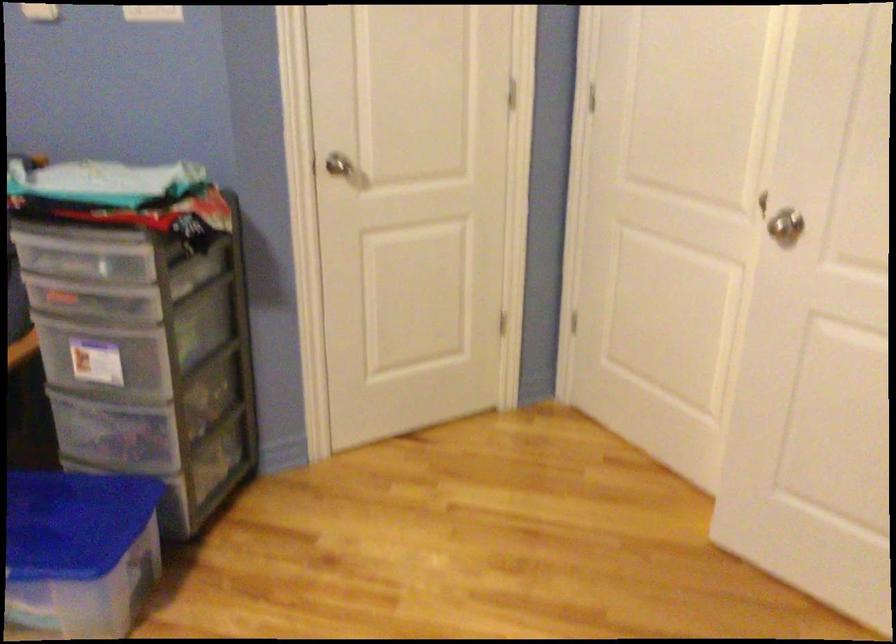
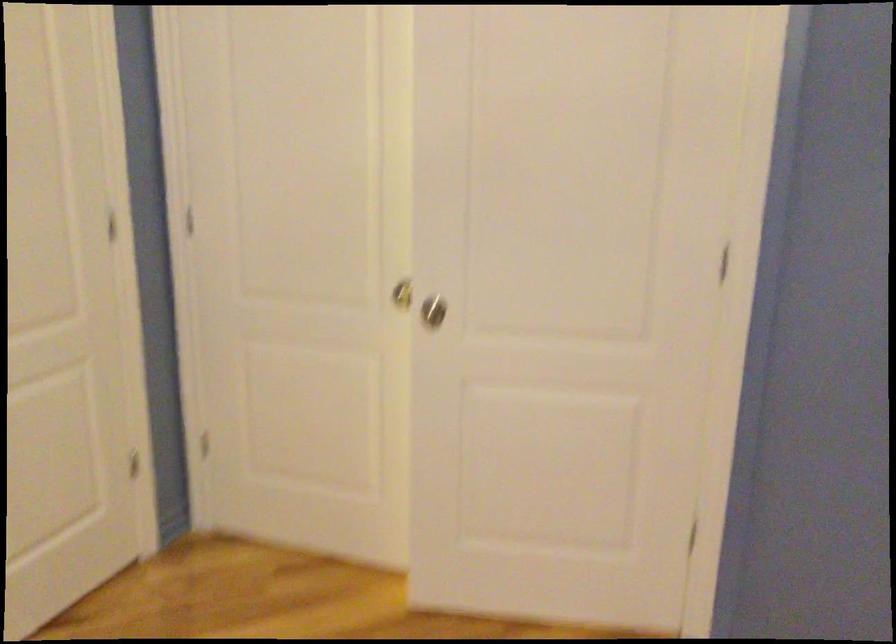
In the second image, find the point that corresponds to the point at 794,214 in the first image.

(433, 310)